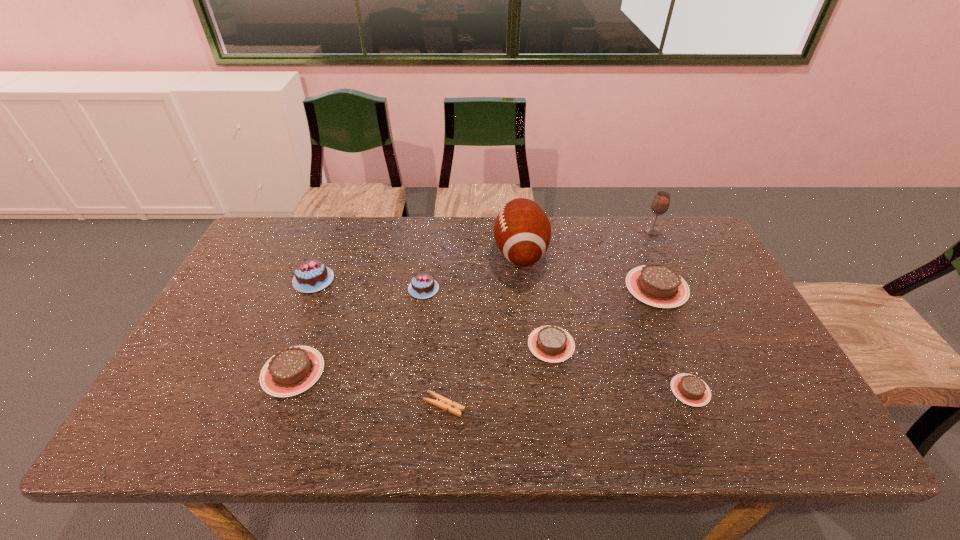
Where is `brown football`? brown football is located at coordinates (522, 231).

Identify the location of football. Image resolution: width=960 pixels, height=540 pixels. (522, 231).

I want to click on glass drink container, so [x=660, y=204].

You are a GUI agent. You are given a task and a screenshot of the screen. Output one action in this format:
    pyautogui.click(x=<x>, y=<y>)
    Task: Click on the third tallest object
    Image resolution: width=960 pixels, height=540 pixels.
    Given the screenshot: What is the action you would take?
    pyautogui.click(x=310, y=276)

Locate an element on the screen. The image size is (960, 540). the bigger pink chocolate cake is located at coordinates (310, 276).

This screenshot has width=960, height=540. I want to click on the fourth chocolate cake from right to left, so click(423, 285).

Where is `the smaller pink chocolate cake`? This screenshot has width=960, height=540. the smaller pink chocolate cake is located at coordinates (423, 285).

Image resolution: width=960 pixels, height=540 pixels. What are the coordinates of `the biggest brown chocolate cake` in the screenshot? It's located at (658, 285).

Identify the location of the fourth shortest object. (293, 370).

I want to click on the third smallest brown chocolate cake, so click(x=293, y=370).